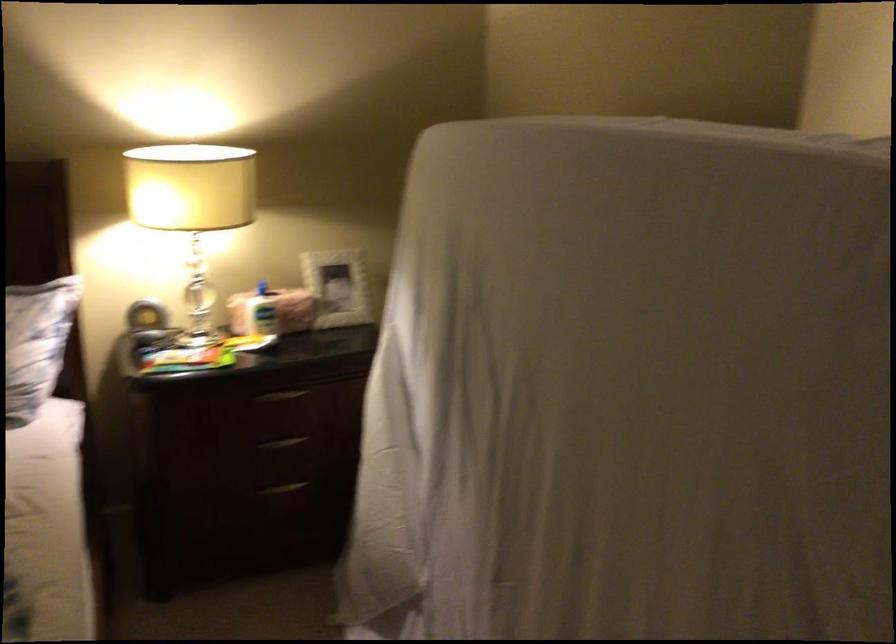
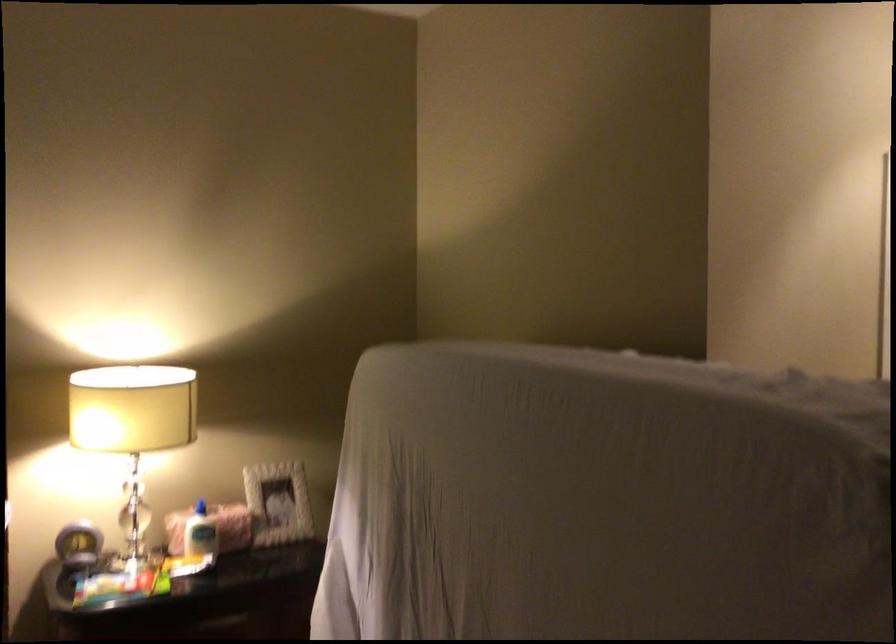
The images are taken continuously from a first-person perspective. In which direction are you moving?

The cameraman moved toward left, backward.